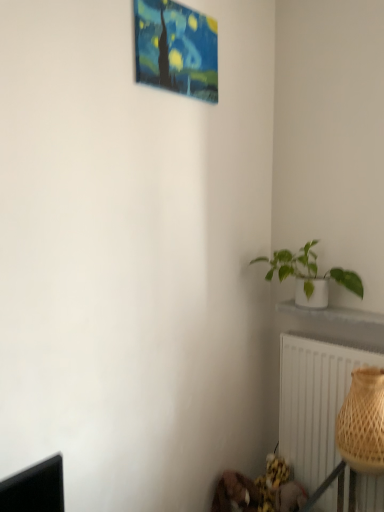
Question: Is white matte pot at right to the right of painted canvas painting at upper center from the viewer's perspective?

Choices:
 (A) no
 (B) yes

Answer: (B)

Question: Is the depth of white matte pot at right greater than that of painted canvas painting at upper center?

Choices:
 (A) no
 (B) yes

Answer: (B)

Question: Does white matte pot at right have a larger size compared to painted canvas painting at upper center?

Choices:
 (A) yes
 (B) no

Answer: (A)

Question: Is white matte pot at right touching painted canvas painting at upper center?

Choices:
 (A) no
 (B) yes

Answer: (A)

Question: Is white matte pot at right located outside painted canvas painting at upper center?

Choices:
 (A) yes
 (B) no

Answer: (A)

Question: In terms of size, does white ceramic plant pot at lower right appear bigger or smaller than white textured radiator at lower right?

Choices:
 (A) small
 (B) big

Answer: (A)

Question: From a real-world perspective, is white ceramic plant pot at lower right above or below white textured radiator at lower right?

Choices:
 (A) below
 (B) above

Answer: (B)

Question: Is point (289, 307) positioned closer to the camera than point (352, 348)?

Choices:
 (A) farther
 (B) closer

Answer: (A)

Question: Is white ceramic plant pot at lower right spatially inside white textured radiator at lower right, or outside of it?

Choices:
 (A) inside
 (B) outside

Answer: (B)

Question: Considering the positions of painted canvas painting at upper center and white ceramic plant pot at lower right in the image, is painted canvas painting at upper center taller or shorter than white ceramic plant pot at lower right?

Choices:
 (A) tall
 (B) short

Answer: (A)

Question: Does point (172, 15) appear closer or farther from the camera than point (324, 316)?

Choices:
 (A) closer
 (B) farther

Answer: (A)

Question: Is painted canvas painting at upper center in front of or behind white ceramic plant pot at lower right in the image?

Choices:
 (A) front
 (B) behind

Answer: (A)

Question: Do you think painted canvas painting at upper center is within white ceramic plant pot at lower right, or outside of it?

Choices:
 (A) outside
 (B) inside

Answer: (A)

Question: From a real-world perspective, relative to white ceramic plant pot at lower right, is brown woven basket at lower right vertically above or below?

Choices:
 (A) below
 (B) above

Answer: (A)

Question: Considering the positions of point coord(350,402) and point coord(337,313), is point coord(350,402) closer or farther from the camera than point coord(337,313)?

Choices:
 (A) farther
 (B) closer

Answer: (B)